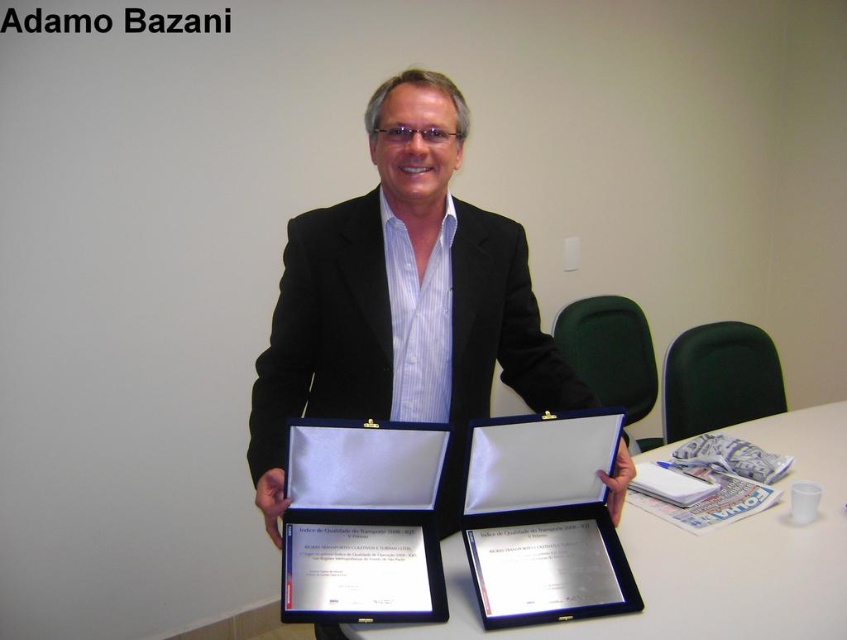
You are a person who wants to place the satin silver certificate at center on the blue fabric table at center. Can you do that?

The blue fabric table at center is much taller than the satin silver certificate at center, so placing the certificate on the table would require lifting it higher than usual, but it is possible.

You are standing 10 feet away from the man in the image. If you want to reach the point at coordinates point (804, 410), which is located on the table to the right of the man, do you need to move closer or farther away?

The point at coordinates point (804, 410) is 9.67 feet away from the camera. Since you are currently 10 feet away from the man, you need to move closer to reach the point.

You are organizing an awards ceremony and need to place the blue fabric table at center and the satin silver certificate at center in a way that aligns with their positions in the image. Where should you position the blue fabric table relative to the satin silver certificate?

The blue fabric table at center should be positioned below the satin silver certificate at center as per the image description.